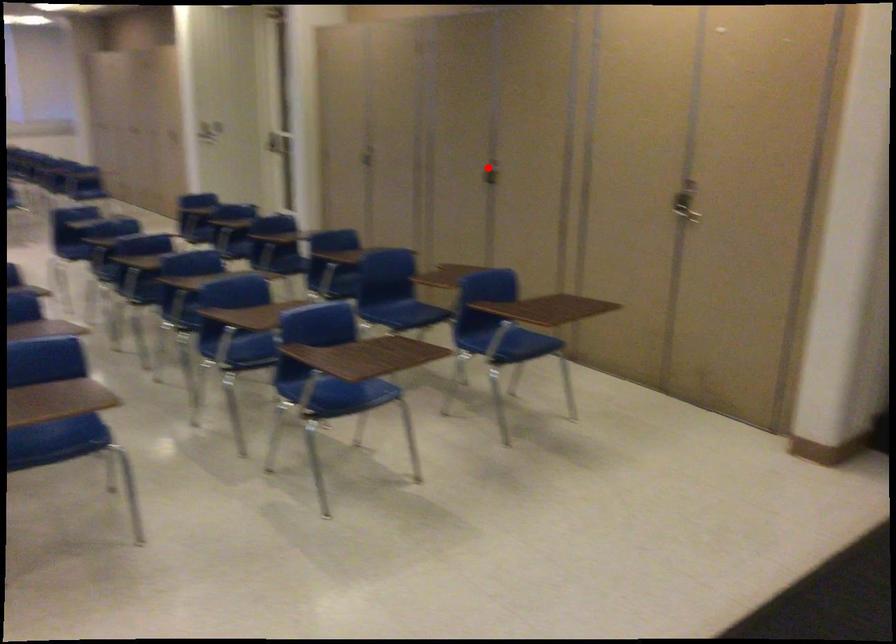
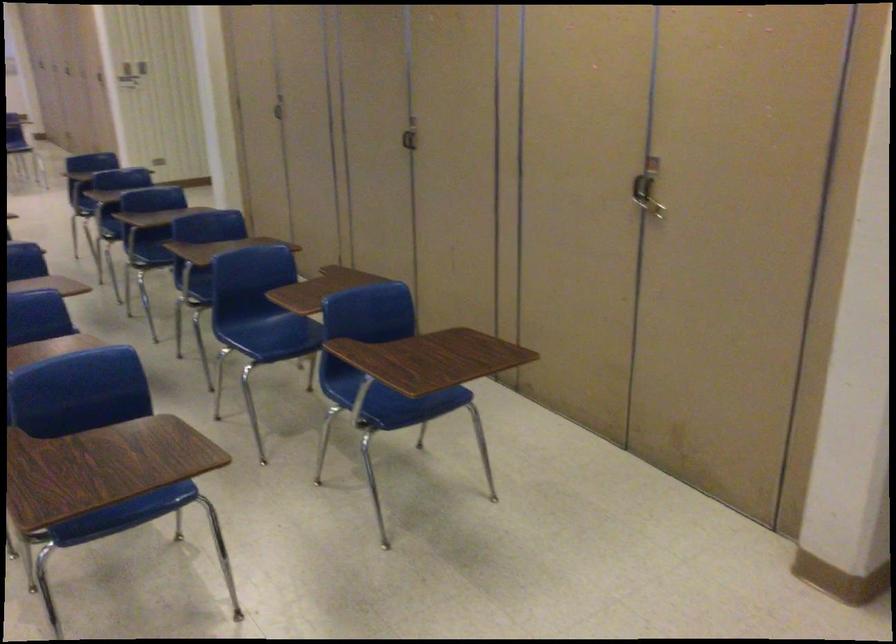
Locate, in the second image, the point that corresponds to the highlighted location in the first image.

(409, 136)